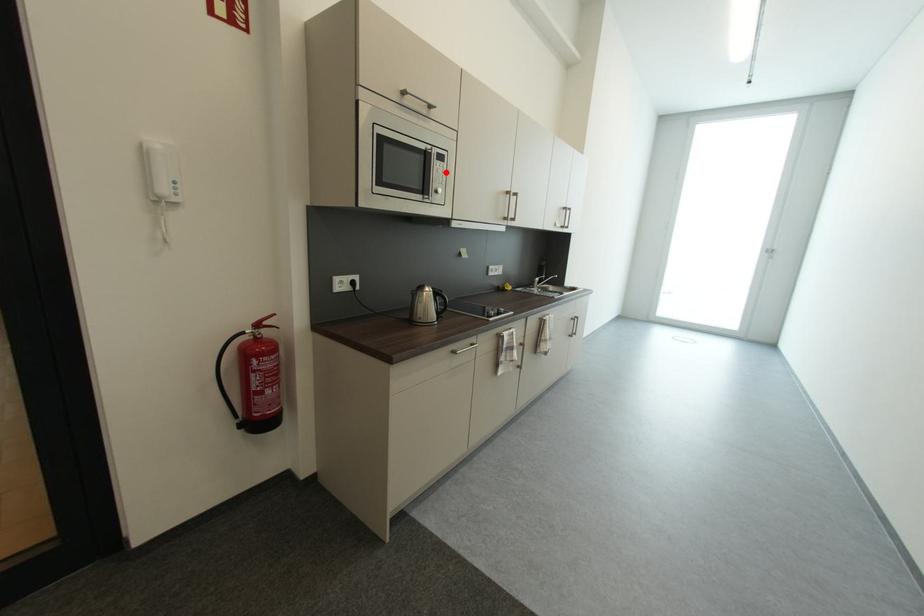
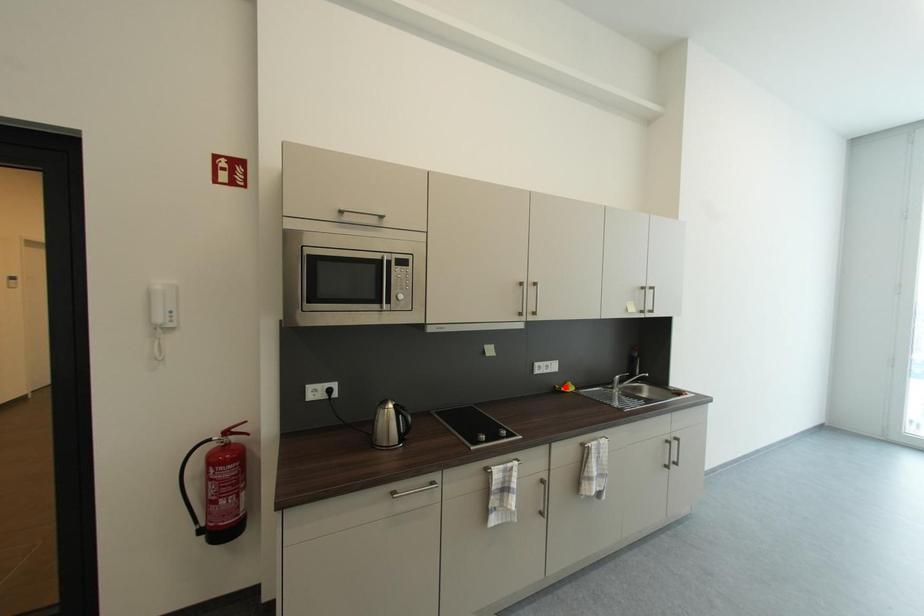
I am providing you with two images of the same scene from different viewpoints. A red point is marked on the first image and another point is marked on the second image. Is the marked point in image1 the same physical position as the marked point in image2?

No